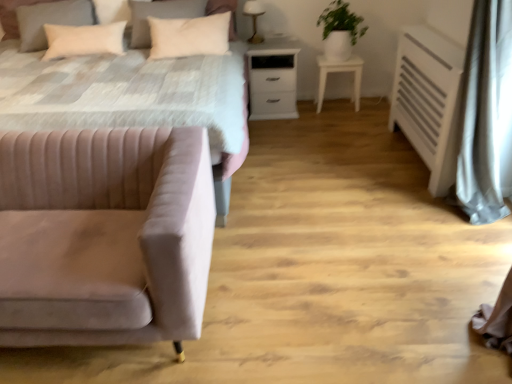
Question: Is white soft pillow at upper left, which appears as the 3th pillow when viewed from the left, bigger than velvet pink couch at lower left?

Choices:
 (A) no
 (B) yes

Answer: (A)

Question: Considering the relative sizes of white soft pillow at upper left, which appears as the 3th pillow when viewed from the left, and velvet pink couch at lower left in the image provided, is white soft pillow at upper left, which appears as the 3th pillow when viewed from the left, thinner than velvet pink couch at lower left?

Choices:
 (A) yes
 (B) no

Answer: (A)

Question: Is white soft pillow at upper left, marked as the 1th pillow in a right-to-left arrangement, oriented towards velvet pink couch at lower left?

Choices:
 (A) yes
 (B) no

Answer: (A)

Question: From the image's perspective, is white soft pillow at upper left, marked as the 1th pillow in a right-to-left arrangement, beneath velvet pink couch at lower left?

Choices:
 (A) no
 (B) yes

Answer: (A)

Question: Is white soft pillow at upper left, which appears as the 3th pillow when viewed from the left, turned away from velvet pink couch at lower left?

Choices:
 (A) no
 (B) yes

Answer: (A)

Question: From a real-world perspective, is velvet pink couch at lower left physically located above or below white sheer curtain at right?

Choices:
 (A) above
 (B) below

Answer: (B)

Question: Is velvet pink couch at lower left bigger or smaller than white sheer curtain at right?

Choices:
 (A) small
 (B) big

Answer: (B)

Question: Is velvet pink couch at lower left inside or outside of white sheer curtain at right?

Choices:
 (A) inside
 (B) outside

Answer: (B)

Question: From the image's perspective, relative to white sheer curtain at right, is velvet pink couch at lower left above or below?

Choices:
 (A) below
 (B) above

Answer: (A)

Question: Visually, is white soft pillow at upper left, marked as the 1th pillow in a right-to-left arrangement, positioned to the left or to the right of beige velvet pillow at upper left, arranged as the third pillow when viewed from the right?

Choices:
 (A) left
 (B) right

Answer: (B)

Question: Relative to beige velvet pillow at upper left, arranged as the third pillow when viewed from the right, is white soft pillow at upper left, marked as the 1th pillow in a right-to-left arrangement, in front or behind?

Choices:
 (A) front
 (B) behind

Answer: (A)

Question: Considering the positions of white soft pillow at upper left, marked as the 1th pillow in a right-to-left arrangement, and beige velvet pillow at upper left, arranged as the 1th pillow when viewed from the left, in the image, is white soft pillow at upper left, marked as the 1th pillow in a right-to-left arrangement, taller or shorter than beige velvet pillow at upper left, arranged as the 1th pillow when viewed from the left,?

Choices:
 (A) tall
 (B) short

Answer: (A)

Question: From the image's perspective, is white soft pillow at upper left, which appears as the 3th pillow when viewed from the left, positioned above or below beige velvet pillow at upper left, arranged as the 1th pillow when viewed from the left?

Choices:
 (A) below
 (B) above

Answer: (A)

Question: In terms of width, does white matte nightstand at center look wider or thinner when compared to green matte plant at upper right?

Choices:
 (A) wide
 (B) thin

Answer: (A)

Question: Considering the relative positions of white matte nightstand at center and green matte plant at upper right in the image provided, is white matte nightstand at center to the left or to the right of green matte plant at upper right?

Choices:
 (A) left
 (B) right

Answer: (A)